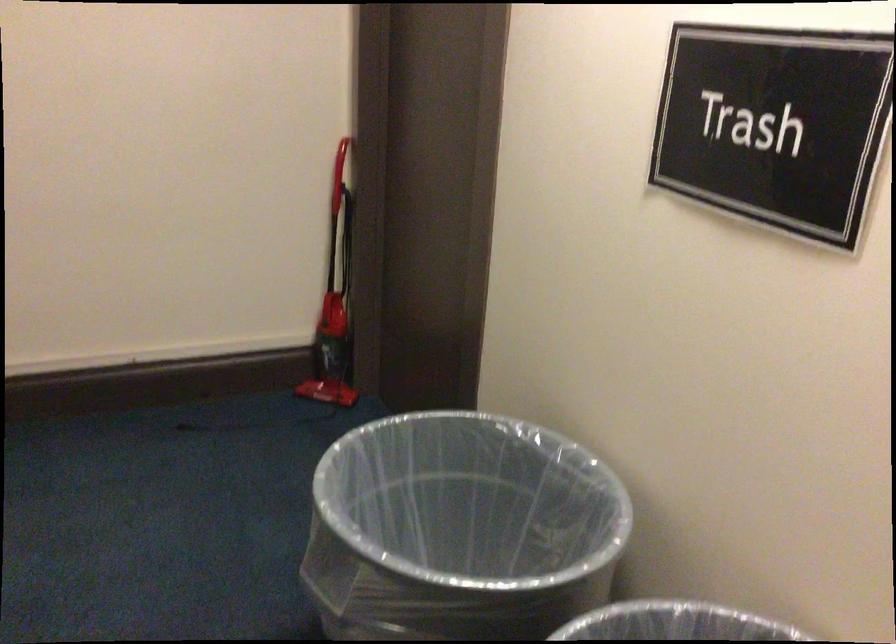
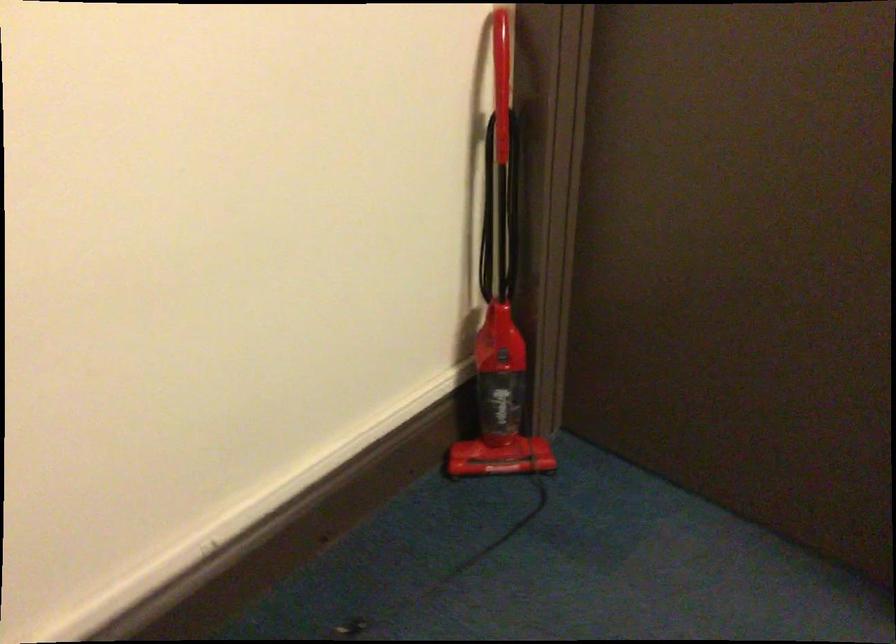
In a continuous first-person perspective shot, in which direction is the camera moving?

The cameraman moved toward left, forward.